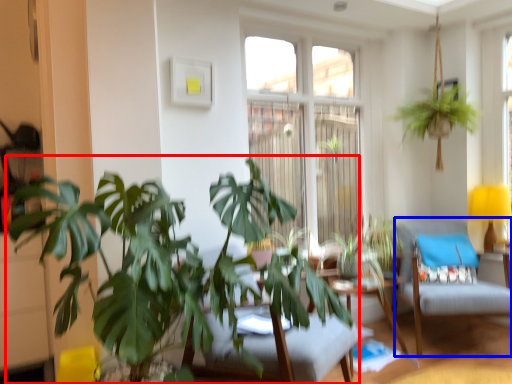
Question: Which point is closer to the camera, houseplant (highlighted by a red box) or swivel chair (highlighted by a blue box)?

Choices:
 (A) houseplant
 (B) swivel chair

Answer: (A)